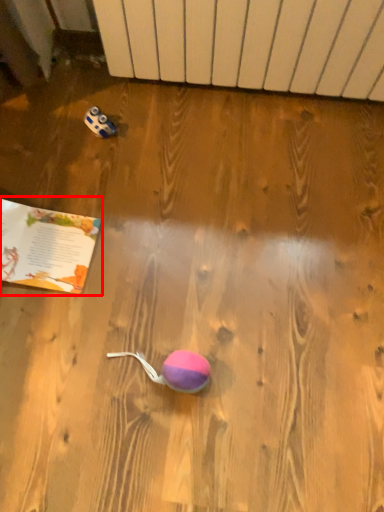
Question: From the image's perspective, where is book (annotated by the red box) located relative to radiator?

Choices:
 (A) below
 (B) above

Answer: (A)